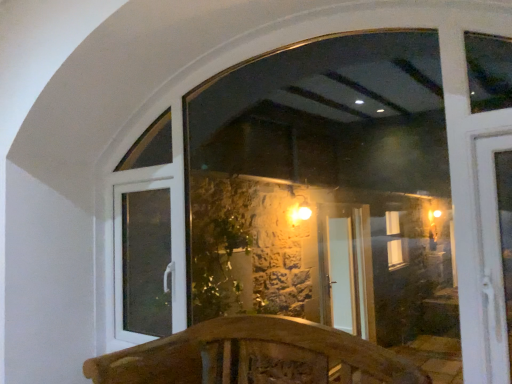
Question: Can you confirm if transparent glass window at center is thinner than wooden carved bench at center?

Choices:
 (A) no
 (B) yes

Answer: (B)

Question: Does transparent glass window at center come behind wooden carved bench at center?

Choices:
 (A) yes
 (B) no

Answer: (A)

Question: Is transparent glass window at center taller than wooden carved bench at center?

Choices:
 (A) no
 (B) yes

Answer: (B)

Question: Is transparent glass window at center turned away from wooden carved bench at center?

Choices:
 (A) no
 (B) yes

Answer: (B)

Question: Could you tell me if transparent glass window at center is turned towards wooden carved bench at center?

Choices:
 (A) yes
 (B) no

Answer: (A)

Question: Considering the positions of point (227, 165) and point (114, 190), is point (227, 165) closer or farther from the camera than point (114, 190)?

Choices:
 (A) closer
 (B) farther

Answer: (B)

Question: From a real-world perspective, is transparent glass window at center positioned above or below white plastic door at lower left?

Choices:
 (A) above
 (B) below

Answer: (A)

Question: In terms of height, does transparent glass window at center look taller or shorter compared to white plastic door at lower left?

Choices:
 (A) tall
 (B) short

Answer: (A)

Question: Would you say transparent glass window at center is inside or outside white plastic door at lower left?

Choices:
 (A) inside
 (B) outside

Answer: (B)

Question: Considering the positions of point coord(142,382) and point coord(378,331), is point coord(142,382) closer or farther from the camera than point coord(378,331)?

Choices:
 (A) closer
 (B) farther

Answer: (A)

Question: Relative to transparent glass window at center, is wooden carved bench at center in front or behind?

Choices:
 (A) behind
 (B) front

Answer: (B)

Question: From the image's perspective, is wooden carved bench at center above or below transparent glass window at center?

Choices:
 (A) below
 (B) above

Answer: (A)

Question: From a real-world perspective, is wooden carved bench at center physically located above or below transparent glass window at center?

Choices:
 (A) above
 (B) below

Answer: (B)

Question: In terms of size, does transparent glass window at center appear bigger or smaller than wooden carved bench at center?

Choices:
 (A) small
 (B) big

Answer: (A)

Question: Choose the correct answer: Is transparent glass window at center inside wooden carved bench at center or outside it?

Choices:
 (A) outside
 (B) inside

Answer: (A)